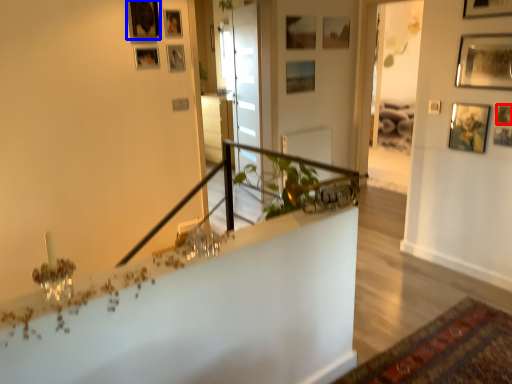
Question: Which object is closer to the camera taking this photo, picture frame (highlighted by a red box) or picture frame (highlighted by a blue box)?

Choices:
 (A) picture frame
 (B) picture frame

Answer: (A)